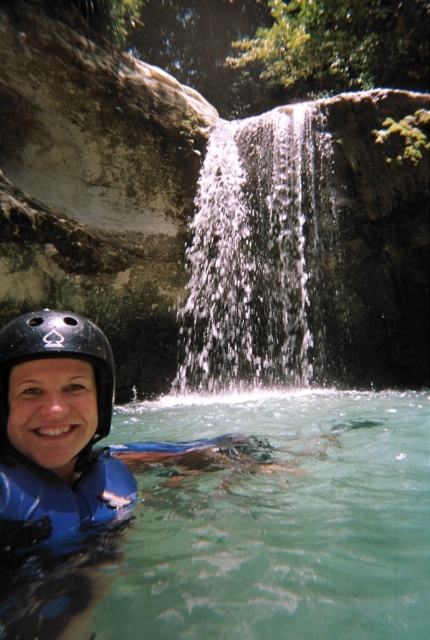
Question: Is clear blue water at lower center thinner than black matte helmet at lower left?

Choices:
 (A) yes
 (B) no

Answer: (B)

Question: Which of the following is the closest to the observer?

Choices:
 (A) black matte helmet at lower left
 (B) clear blue water at lower center

Answer: (A)

Question: Which point appears farthest from the camera in this image?

Choices:
 (A) tap(85, 321)
 (B) tap(205, 326)

Answer: (B)

Question: Which object appears closest to the camera in this image?

Choices:
 (A) white frothy water at center
 (B) black matte helmet at lower left
 (C) clear blue water at lower center

Answer: (B)

Question: Does clear blue water at lower center appear on the right side of black matte helmet at lower left?

Choices:
 (A) yes
 (B) no

Answer: (A)

Question: Does clear blue water at lower center have a lesser width compared to white frothy water at center?

Choices:
 (A) yes
 (B) no

Answer: (A)